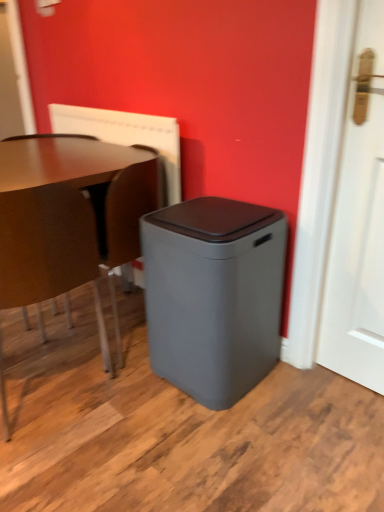
This screenshot has height=512, width=384. Find the location of `free location to the right of matte brown chair at left`. free location to the right of matte brown chair at left is located at coordinates (136, 409).